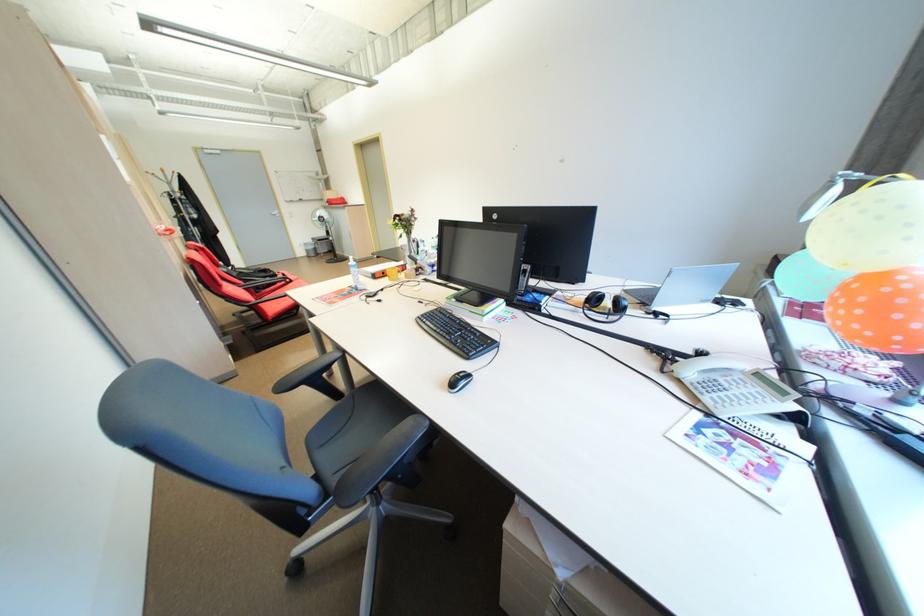
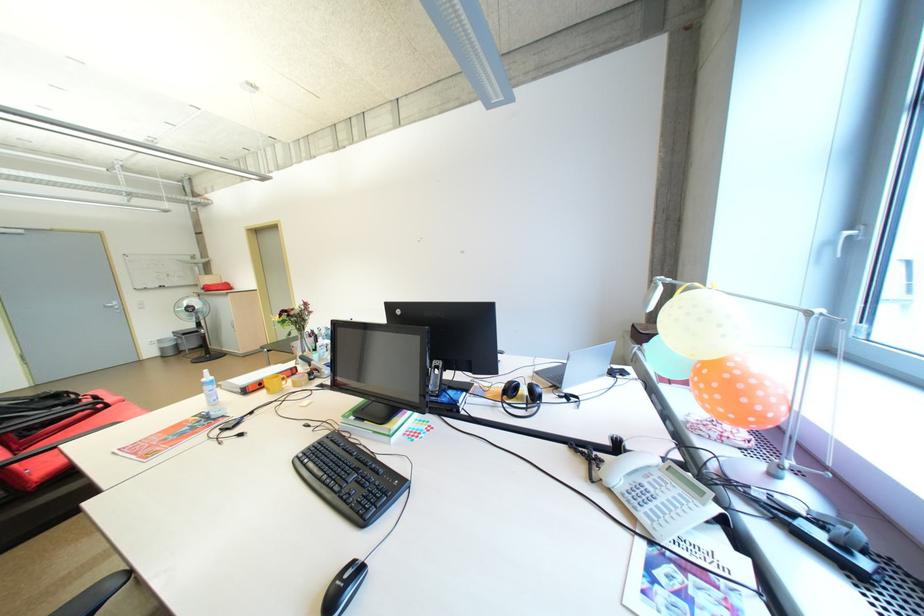
Question: Based on the continuous images, in which direction is the camera rotating? Reply with the corresponding letter.

Choices:
 (A) Left
 (B) Right
 (C) Up
 (D) Down

Answer: (B)